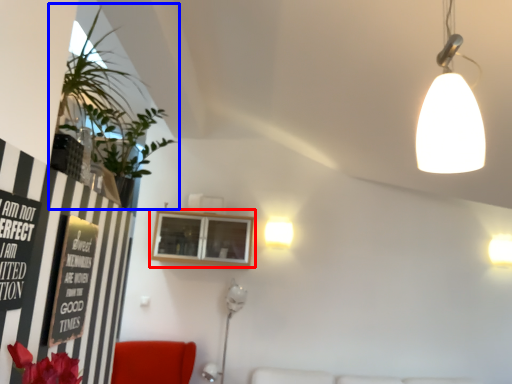
Question: Among these objects, which one is nearest to the camera, window (highlighted by a red box) or houseplant (highlighted by a blue box)?

Choices:
 (A) window
 (B) houseplant

Answer: (B)